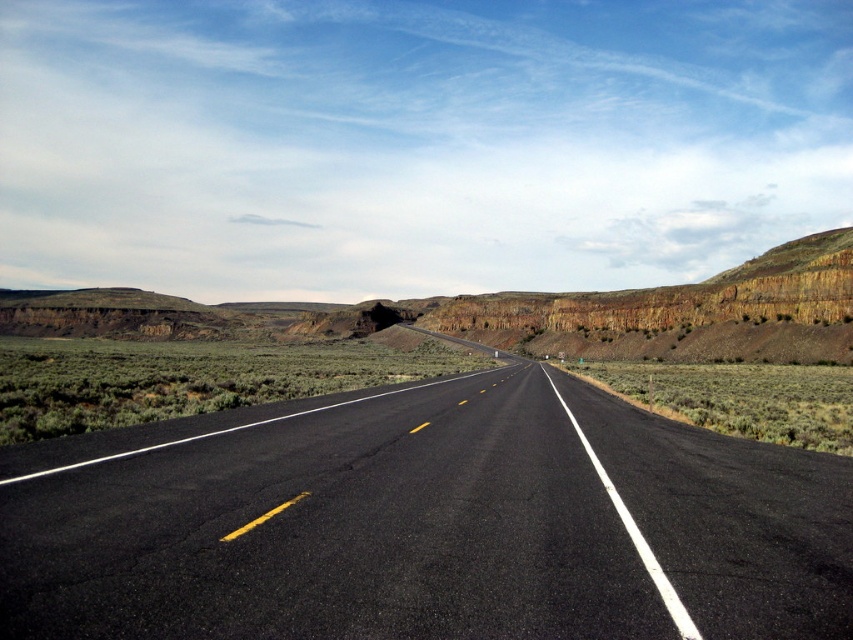
Is black asphalt highway at center taller than rustic rock formation at center?

Incorrect, black asphalt highway at center's height is not larger of rustic rock formation at center's.

Does black asphalt highway at center come in front of rustic rock formation at center?

Yes.

Find the location of a particular element. Image resolution: width=853 pixels, height=640 pixels. black asphalt highway at center is located at coordinates (425, 522).